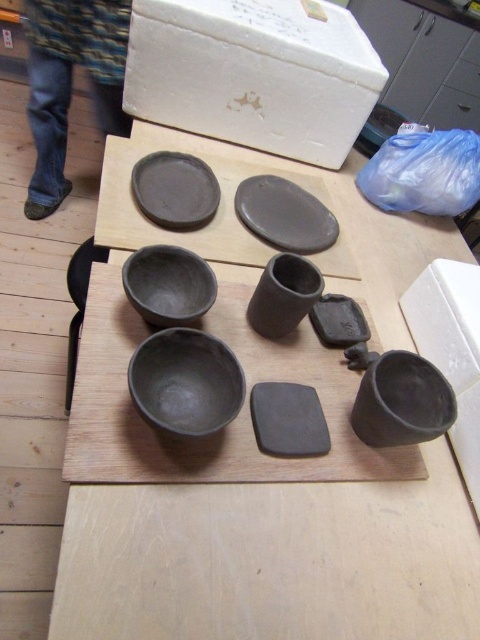
You are a delivery person who needs to pack the matte clay bowls at center and the matte black plate at upper center into a box. Based on their positions on the table, which item is closer to you and should be picked up first?

The matte clay bowls at center is in front of the matte black plate at upper center, so it is closer to you and should be picked up first.

You are an artist who wants to place a small sculpture between the matte black cup at lower right and the matte black cup at center on the table. Which cup should you move to make space?

The matte black cup at lower right is closer to the viewer than the matte black cup at center, so you should move the matte black cup at lower right to make space for the sculpture.

You are a delivery person who needs to pack the matte clay bowls at center and the matte black plate at upper center into a box. Based on the scene, which object requires a wider space in the box?

The matte clay bowls at center require a wider space in the box because their width is larger than the matte black plate at upper center.